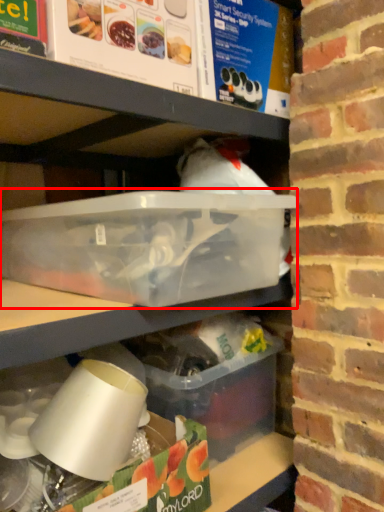
Question: From the image's perspective, considering the relative positions of box (annotated by the red box) and box in the image provided, where is box (annotated by the red box) located with respect to the staircase?

Choices:
 (A) below
 (B) above

Answer: (B)